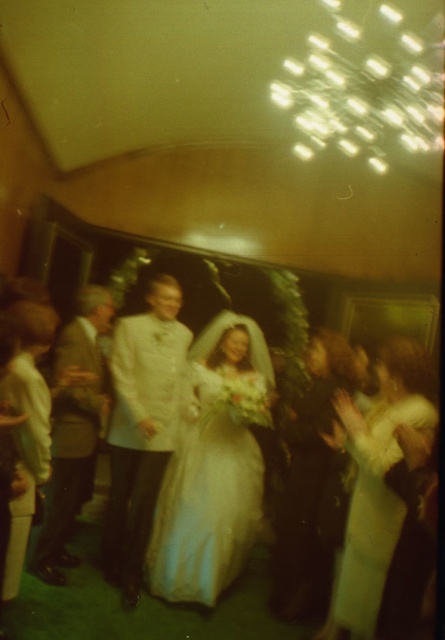
Question: Does white satin dress at lower right have a greater width compared to white satin dress at center?

Choices:
 (A) no
 (B) yes

Answer: (A)

Question: Does silky white gown at center appear on the right side of white satin dress at center?

Choices:
 (A) no
 (B) yes

Answer: (B)

Question: Estimate the real-world distances between objects in this image. Which object is farther from the silky white gown at center?

Choices:
 (A) white satin dress at center
 (B) silky white dress at center

Answer: (A)

Question: Can you confirm if white satin suit at center is wider than silky white dress at center?

Choices:
 (A) no
 (B) yes

Answer: (A)

Question: Which is nearer to the silky white gown at center?

Choices:
 (A) white satin dress at center
 (B) silky white dress at center

Answer: (B)

Question: Which point is farther from the camera taking this photo?

Choices:
 (A) [x=71, y=349]
 (B) [x=210, y=595]
 (C) [x=152, y=608]
 (D) [x=336, y=545]

Answer: (A)